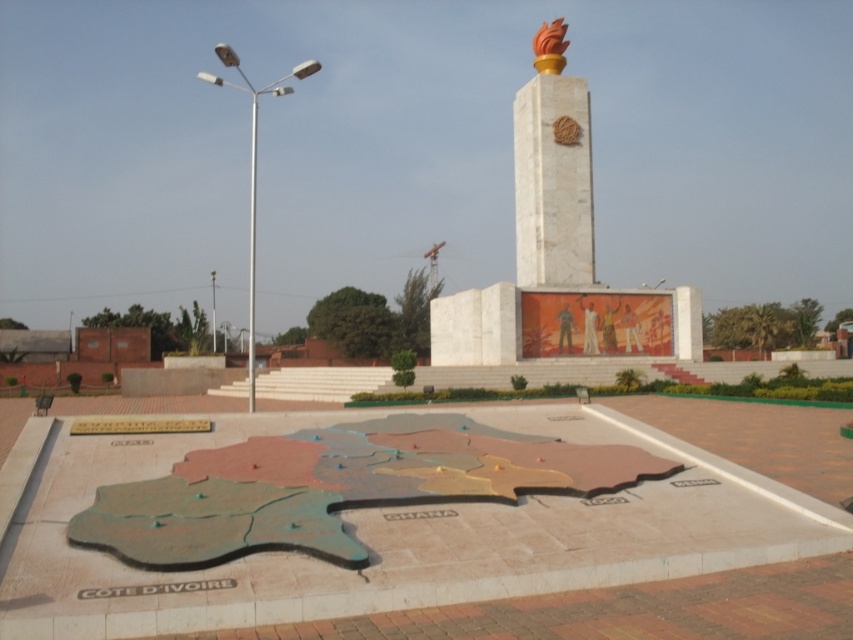
Is white marble monument at center above white marble obelisk at upper center?

No.

Can you confirm if white marble monument at center is positioned below white marble obelisk at upper center?

Correct, white marble monument at center is located below white marble obelisk at upper center.

You are a GUI agent. You are given a task and a screenshot of the screen. Output one action in this format:
    pyautogui.click(x=<x>, y=<y>)
    Task: Click on the white marble monument at center
    
    Given the screenshot: What is the action you would take?
    pyautogui.click(x=558, y=252)

This screenshot has height=640, width=853. I want to click on white marble monument at center, so click(x=558, y=252).